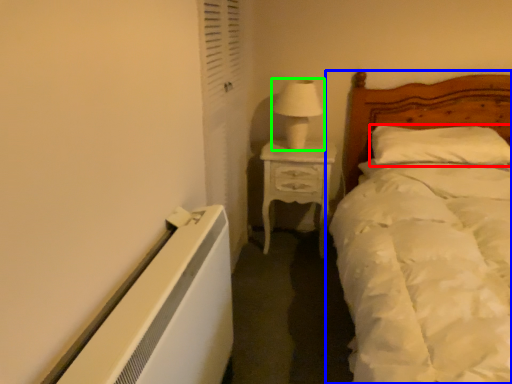
Question: Which object is the farthest from pillow (highlighted by a red box)? Choose among these: bed (highlighted by a blue box) or table lamp (highlighted by a green box).

Choices:
 (A) bed
 (B) table lamp

Answer: (B)